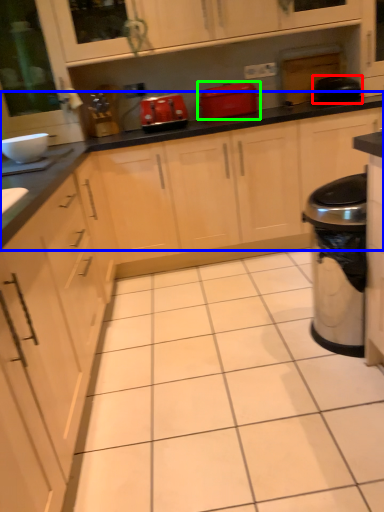
Question: Which is nearer to the appliance (highlighted by a red box)? countertop (highlighted by a blue box) or home appliance (highlighted by a green box).

Choices:
 (A) countertop
 (B) home appliance

Answer: (A)